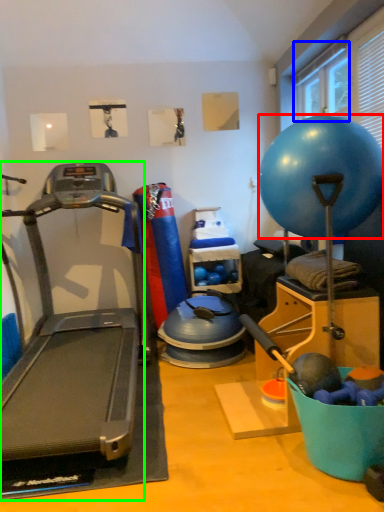
Question: Which object is the closest to the ball (highlighted by a red box)? Choose among these: window screen (highlighted by a blue box) or treadmill (highlighted by a green box).

Choices:
 (A) window screen
 (B) treadmill

Answer: (A)